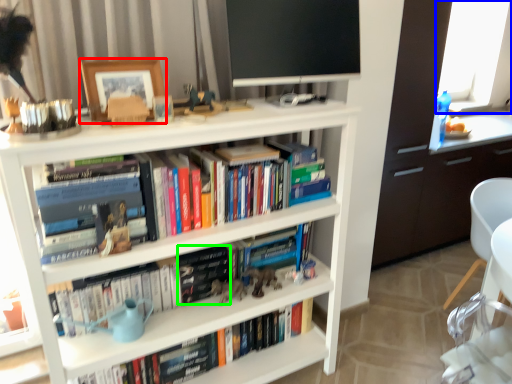
Question: Which is nearer to the picture frame (highlighted by a red box)? window screen (highlighted by a blue box) or paperback book (highlighted by a green box).

Choices:
 (A) window screen
 (B) paperback book

Answer: (B)